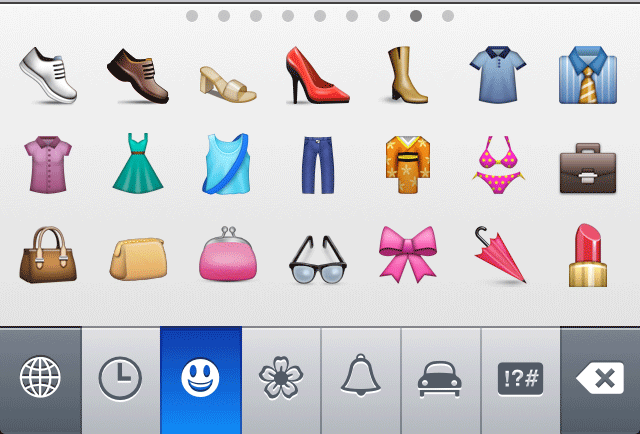
The image size is (640, 434). What are the coordinates of `accessories` in the screenshot? It's located at (589, 167), (57, 255), (146, 265), (249, 257), (321, 267), (404, 259).